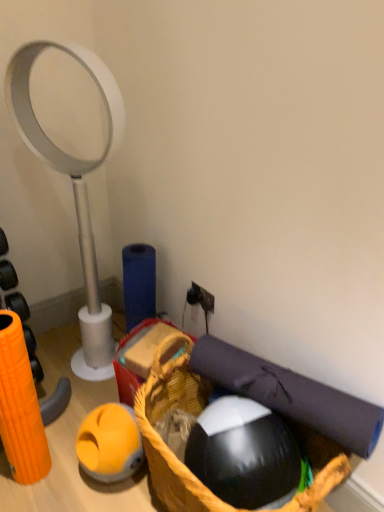
Question: Would you say black rubber ball at lower center contains white plastic magnifying glass at left?

Choices:
 (A) yes
 (B) no

Answer: (B)

Question: Is black rubber ball at lower center at the left side of white plastic magnifying glass at left?

Choices:
 (A) no
 (B) yes

Answer: (A)

Question: From the image's perspective, is black rubber ball at lower center beneath white plastic magnifying glass at left?

Choices:
 (A) yes
 (B) no

Answer: (A)

Question: Is black rubber ball at lower center positioned in front of white plastic magnifying glass at left?

Choices:
 (A) yes
 (B) no

Answer: (A)

Question: Would you consider black rubber ball at lower center to be distant from white plastic magnifying glass at left?

Choices:
 (A) no
 (B) yes

Answer: (A)

Question: Considering their positions, is woven brown basket at lower center located in front of or behind black rubber ball at lower center?

Choices:
 (A) front
 (B) behind

Answer: (A)

Question: In terms of width, does woven brown basket at lower center look wider or thinner when compared to black rubber ball at lower center?

Choices:
 (A) thin
 (B) wide

Answer: (B)

Question: From a real-world perspective, is woven brown basket at lower center positioned above or below black rubber ball at lower center?

Choices:
 (A) below
 (B) above

Answer: (A)

Question: In terms of height, does woven brown basket at lower center look taller or shorter compared to black rubber ball at lower center?

Choices:
 (A) tall
 (B) short

Answer: (A)

Question: From the image's perspective, is dark blue fabric yoga mat at lower right above or below woven brown basket at lower center?

Choices:
 (A) below
 (B) above

Answer: (B)

Question: Is dark blue fabric yoga mat at lower right taller or shorter than woven brown basket at lower center?

Choices:
 (A) short
 (B) tall

Answer: (A)

Question: Looking at their shapes, would you say dark blue fabric yoga mat at lower right is wider or thinner than woven brown basket at lower center?

Choices:
 (A) thin
 (B) wide

Answer: (A)

Question: Is point (316, 428) closer or farther from the camera than point (301, 500)?

Choices:
 (A) farther
 (B) closer

Answer: (A)

Question: Considering the positions of black rubber ball at lower center and white plastic magnifying glass at left in the image, is black rubber ball at lower center taller or shorter than white plastic magnifying glass at left?

Choices:
 (A) tall
 (B) short

Answer: (B)

Question: Is black rubber ball at lower center to the left or to the right of white plastic magnifying glass at left in the image?

Choices:
 (A) right
 (B) left

Answer: (A)